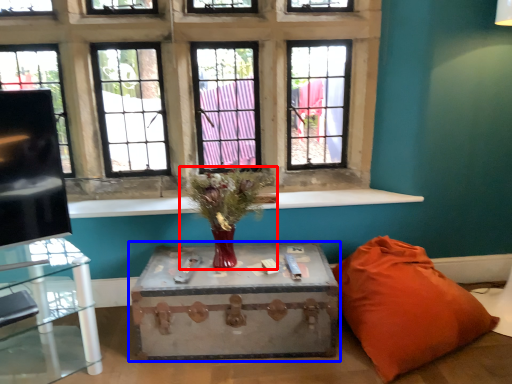
Question: Which object is further to the camera taking this photo, houseplant (highlighted by a red box) or table (highlighted by a blue box)?

Choices:
 (A) houseplant
 (B) table

Answer: (B)